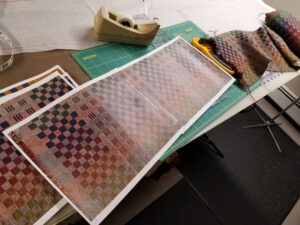
Where is `floor mats`? The width and height of the screenshot is (300, 225). floor mats is located at coordinates (256, 185), (193, 206).